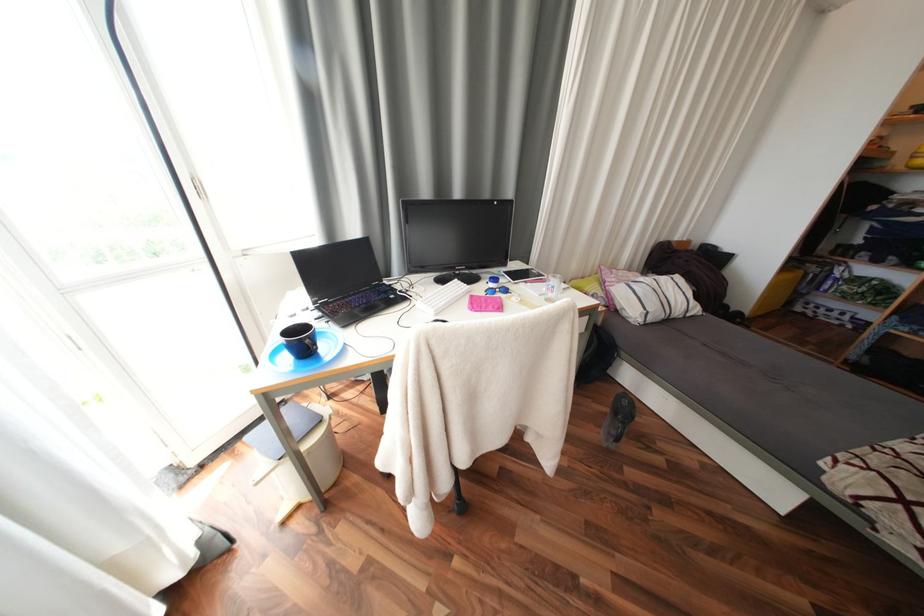
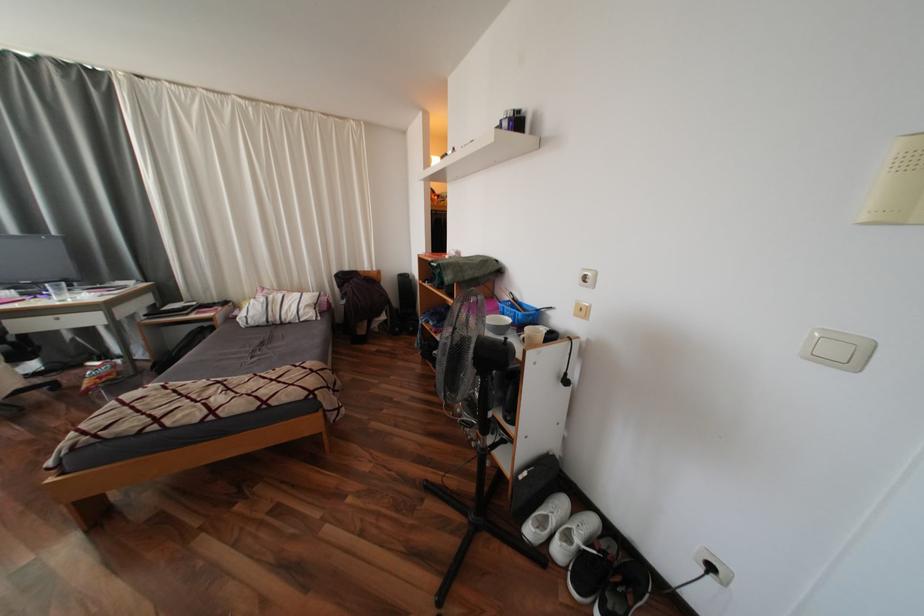
Question: The images are taken continuously from a first-person perspective. In which direction are you moving?

Choices:
 (A) Left
 (B) Right
 (C) Forward
 (D) Backward

Answer: (B)